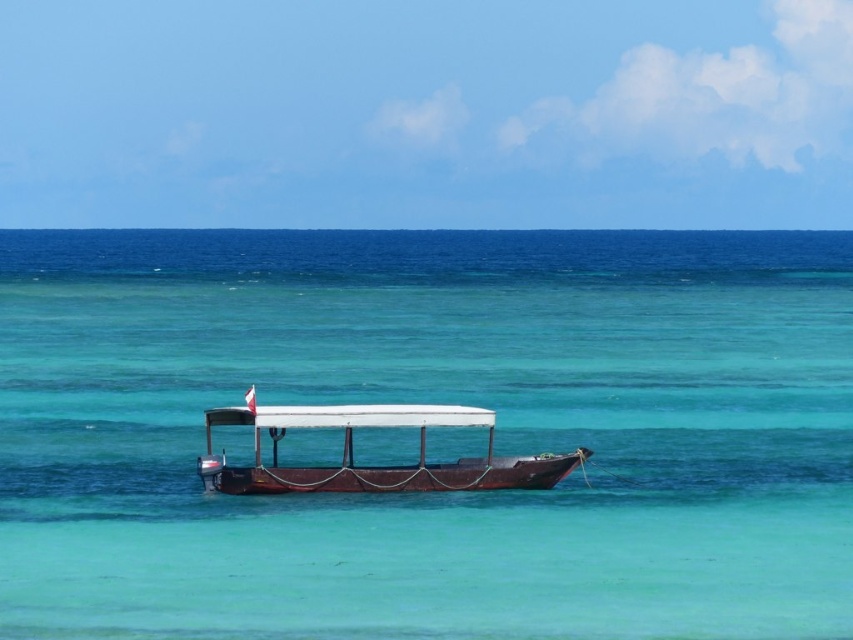
Question: Can you confirm if clear turquoise water at center is positioned above wooden boat at center?

Choices:
 (A) no
 (B) yes

Answer: (B)

Question: Does clear turquoise water at center have a larger size compared to wooden boat at center?

Choices:
 (A) yes
 (B) no

Answer: (A)

Question: Which point is farther to the camera?

Choices:
 (A) clear turquoise water at center
 (B) wooden boat at center

Answer: (B)

Question: Which point appears closest to the camera in this image?

Choices:
 (A) (631, 621)
 (B) (218, 458)

Answer: (A)

Question: Is clear turquoise water at center positioned in front of wooden boat at center?

Choices:
 (A) yes
 (B) no

Answer: (A)